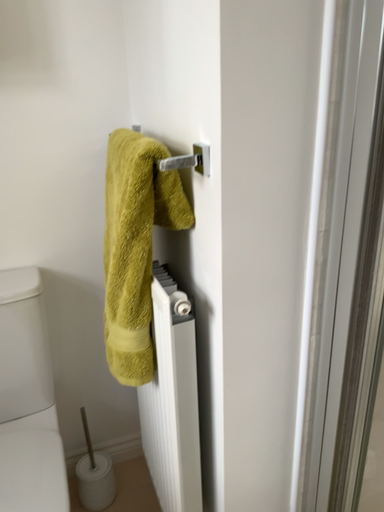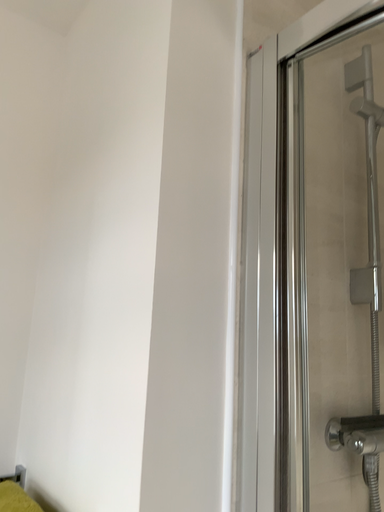
Question: How did the camera likely rotate when shooting the video?

Choices:
 (A) rotated downward
 (B) rotated upward

Answer: (B)